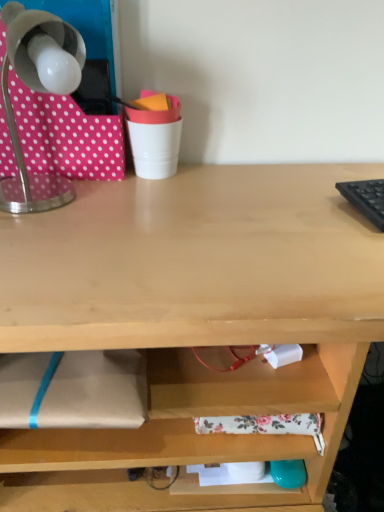
Question: Can metallic gray lamp at upper left be found inside pink polka dot fabric at upper left?

Choices:
 (A) yes
 (B) no

Answer: (B)

Question: Does pink polka dot fabric at upper left have a greater width compared to metallic gray lamp at upper left?

Choices:
 (A) yes
 (B) no

Answer: (B)

Question: From the image's perspective, does pink polka dot fabric at upper left appear lower than metallic gray lamp at upper left?

Choices:
 (A) yes
 (B) no

Answer: (B)

Question: Is pink polka dot fabric at upper left far away from metallic gray lamp at upper left?

Choices:
 (A) yes
 (B) no

Answer: (B)

Question: Is pink polka dot fabric at upper left closer to the viewer compared to metallic gray lamp at upper left?

Choices:
 (A) no
 (B) yes

Answer: (A)

Question: Considering their positions, is pink polka dot fabric at upper left located in front of or behind white plastic cup at upper center?

Choices:
 (A) front
 (B) behind

Answer: (A)

Question: Considering the positions of point (62, 111) and point (180, 117), is point (62, 111) closer or farther from the camera than point (180, 117)?

Choices:
 (A) closer
 (B) farther

Answer: (A)

Question: Looking at the image, does pink polka dot fabric at upper left seem bigger or smaller compared to white plastic cup at upper center?

Choices:
 (A) big
 (B) small

Answer: (A)

Question: Considering the positions of pink polka dot fabric at upper left and white plastic cup at upper center in the image, is pink polka dot fabric at upper left wider or thinner than white plastic cup at upper center?

Choices:
 (A) wide
 (B) thin

Answer: (A)

Question: From a real-world perspective, is metallic gray lamp at upper left above or below white plastic cup at upper center?

Choices:
 (A) below
 (B) above

Answer: (B)

Question: Looking at their shapes, would you say metallic gray lamp at upper left is wider or thinner than white plastic cup at upper center?

Choices:
 (A) wide
 (B) thin

Answer: (A)

Question: Would you say metallic gray lamp at upper left is to the left or to the right of white plastic cup at upper center in the picture?

Choices:
 (A) right
 (B) left

Answer: (B)

Question: From their relative heights in the image, would you say metallic gray lamp at upper left is taller or shorter than white plastic cup at upper center?

Choices:
 (A) short
 (B) tall

Answer: (B)

Question: From a real-world perspective, relative to pink polka dot fabric at upper left, is metallic gray lamp at upper left vertically above or below?

Choices:
 (A) above
 (B) below

Answer: (B)

Question: From the image's perspective, is metallic gray lamp at upper left positioned above or below pink polka dot fabric at upper left?

Choices:
 (A) below
 (B) above

Answer: (A)